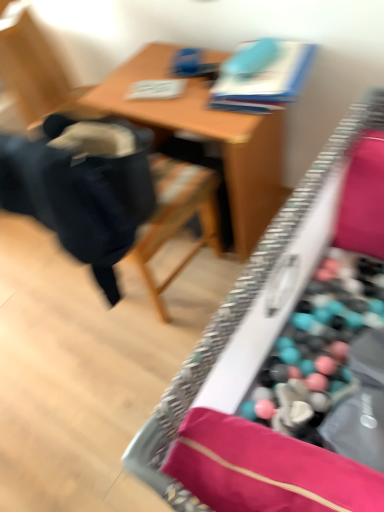
Question: From a real-world perspective, relative to wooden desk at center, is wooden table at center vertically above or below?

Choices:
 (A) above
 (B) below

Answer: (B)

Question: Is wooden table at center inside the boundaries of wooden desk at center, or outside?

Choices:
 (A) inside
 (B) outside

Answer: (B)

Question: Which object is the closest to the black fabric chair at left?

Choices:
 (A) wooden desk at center
 (B) wooden table at center

Answer: (B)

Question: Estimate the real-world distances between objects in this image. Which object is closer to the black fabric chair at left?

Choices:
 (A) wooden desk at center
 (B) wooden table at center

Answer: (B)